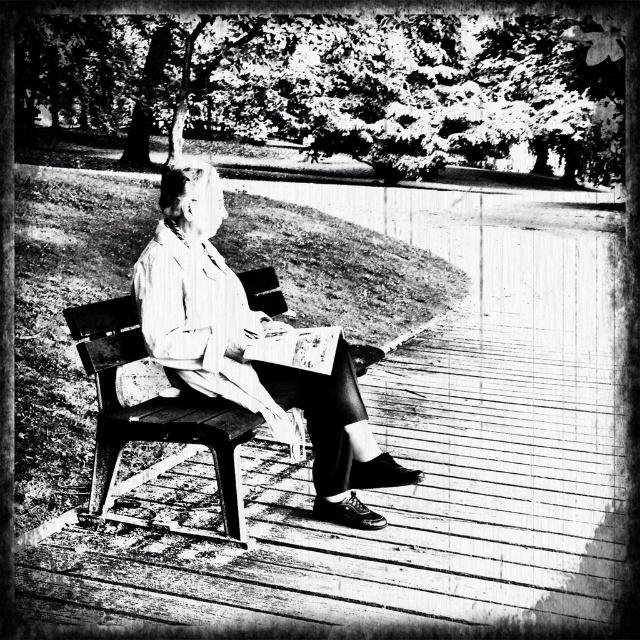
Is point (244, 372) closer to camera compared to point (148, 406)?

Yes, point (244, 372) is in front of point (148, 406).

Between striped fabric coat at center and wooden bench at center, which one appears on the right side from the viewer's perspective?

striped fabric coat at center

Which is in front, point (180, 280) or point (172, 440)?

Positioned in front is point (172, 440).

Find the location of a particular element. striped fabric coat at center is located at coordinates (243, 348).

Between wooden bench at center and paperback book at center, which one is positioned lower?

wooden bench at center is below.

Which is above, wooden bench at center or paperback book at center?

paperback book at center is higher up.

Locate an element on the screen. wooden bench at center is located at coordinates (152, 408).

Can you confirm if striped fabric coat at center is smaller than paperback book at center?

Incorrect, striped fabric coat at center is not smaller in size than paperback book at center.

Does striped fabric coat at center have a lesser width compared to paperback book at center?

No, striped fabric coat at center is not thinner than paperback book at center.

Locate an element on the screen. The width and height of the screenshot is (640, 640). striped fabric coat at center is located at coordinates (243, 348).

The height and width of the screenshot is (640, 640). What are the coordinates of `striped fabric coat at center` in the screenshot? It's located at (243, 348).